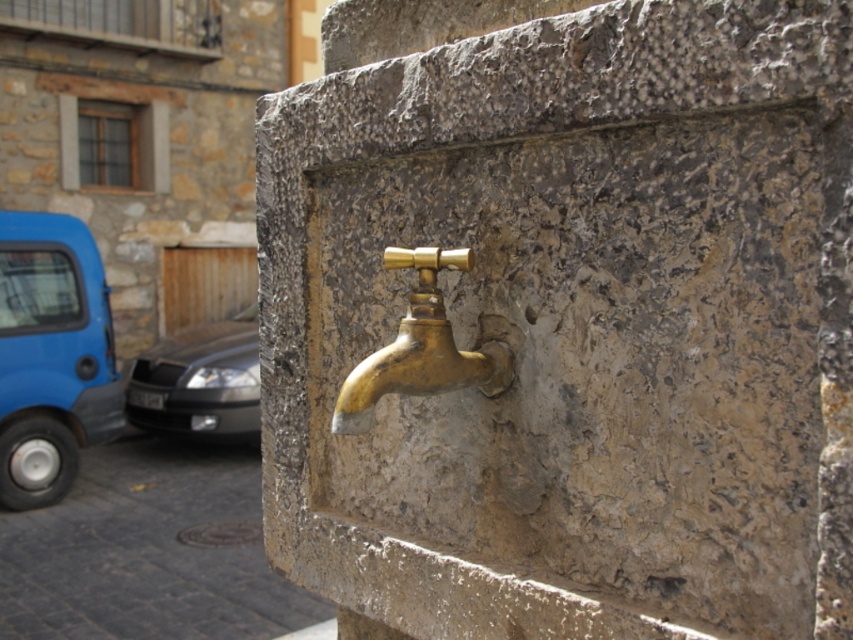
You are a delivery person needing to park your 15 feet long truck between the blue rubber car at left and the gold brass faucet at center. Can you fit your truck there?

The distance between the blue rubber car at left and the gold brass faucet at center is 20.66 feet. Since your truck is 15 feet long, there is enough space to park it between them.